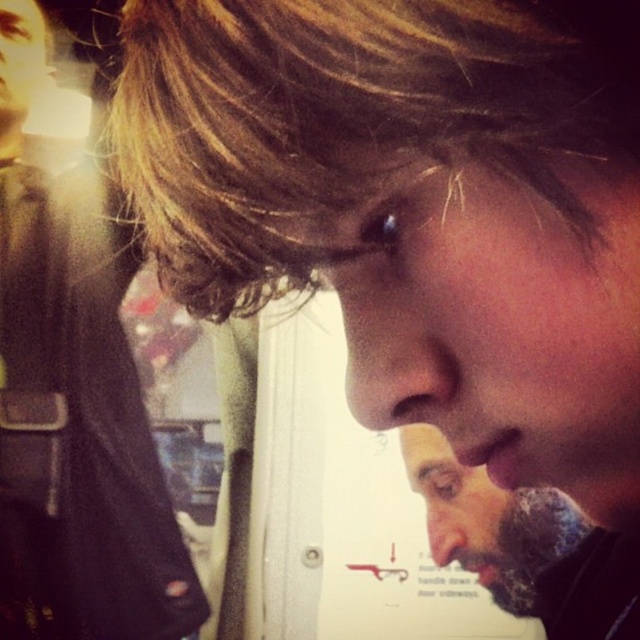
You are a photographer trying to adjust your camera focus. You notice the matte black jacket at left and the smooth skin nose at center in your viewfinder. Which object should you focus on if you want to capture the subject in the foreground more clearly?

The smooth skin nose at center should be focused on because it is in the foreground, closer to the camera than the matte black jacket at left, which is positioned above it.

You are a photographer adjusting lighting for a portrait. You notice two noses in your frame, the matte skin nose at center and the smooth skin nose at center. Which nose appears shorter in the photo?

The matte skin nose at center appears shorter than the smooth skin nose at center in the photo.